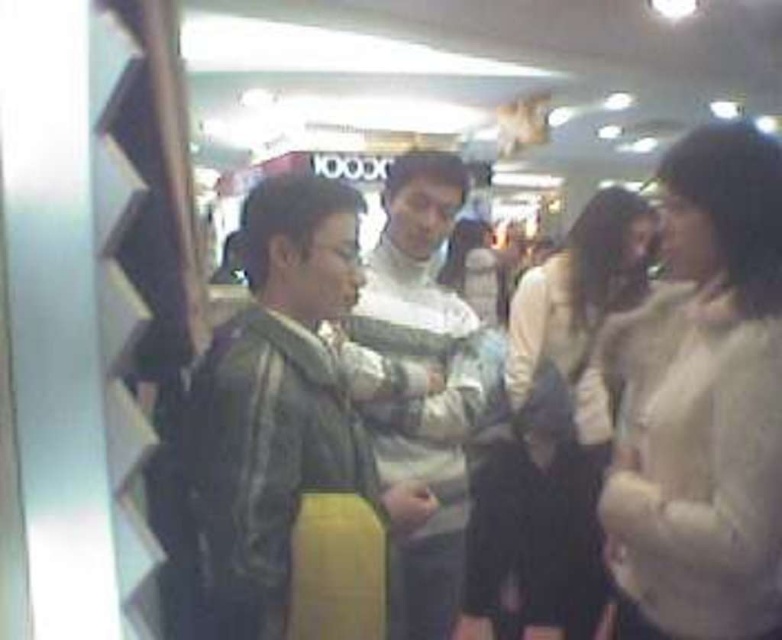
Can you confirm if white fuzzy sweater at right is positioned above camouflage jacket at center?

Actually, white fuzzy sweater at right is below camouflage jacket at center.

Is white fuzzy sweater at right in front of camouflage jacket at center?

That is True.

Does point (605, 496) come farther from viewer compared to point (409, 198)?

No, it is in front of (409, 198).

You are a GUI agent. You are given a task and a screenshot of the screen. Output one action in this format:
    pyautogui.click(x=<x>, y=<y>)
    Task: Click on the white fuzzy sweater at right
    The image size is (782, 640).
    Given the screenshot: What is the action you would take?
    pyautogui.click(x=701, y=403)

Who is positioned more to the right, leather jacket at center or white woolen sweater at center?

white woolen sweater at center is more to the right.

Does leather jacket at center come behind white woolen sweater at center?

No.

Describe the element at coordinates (278, 406) in the screenshot. I see `leather jacket at center` at that location.

At what (x,y) coordinates should I click in order to perform the action: click on leather jacket at center. Please return your answer as a coordinate pair (x, y). The width and height of the screenshot is (782, 640). Looking at the image, I should click on (278, 406).

Can you confirm if white woolen sweater at center is positioned above camouflage jacket at center?

Actually, white woolen sweater at center is below camouflage jacket at center.

Who is higher up, white woolen sweater at center or camouflage jacket at center?

camouflage jacket at center is higher up.

Does point (590, 205) lie behind point (472, 321)?

Yes.

The height and width of the screenshot is (640, 782). I want to click on white woolen sweater at center, so click(572, 396).